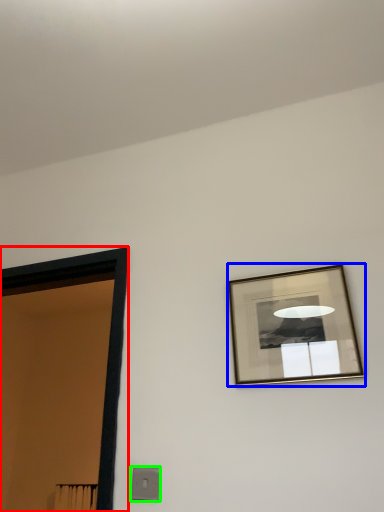
Question: Estimate the real-world distances between objects in this image. Which object is closer to door (highlighted by a red box), picture frame (highlighted by a blue box) or light switch (highlighted by a green box)?

Choices:
 (A) picture frame
 (B) light switch

Answer: (B)